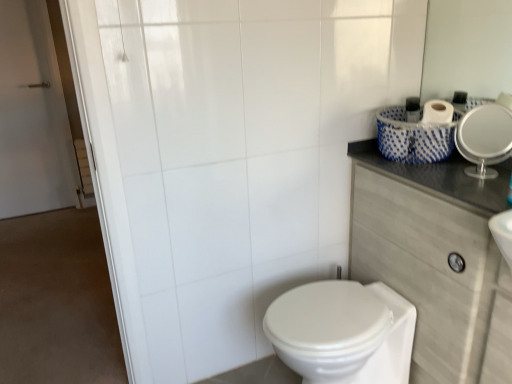
Question: In the image, is dark gray laminate counter top at upper right on the left side or the right side of white glossy mirror at upper right?

Choices:
 (A) left
 (B) right

Answer: (A)

Question: From a real-world perspective, relative to white glossy mirror at upper right, is dark gray laminate counter top at upper right vertically above or below?

Choices:
 (A) above
 (B) below

Answer: (B)

Question: Estimate the real-world distances between objects in this image. Which object is farther from the dark gray laminate counter top at upper right?

Choices:
 (A) white glossy bidet at lower center
 (B) white glossy mirror at upper right

Answer: (B)

Question: Which object is positioned farthest from the white glossy bidet at lower center?

Choices:
 (A) dark gray laminate counter top at upper right
 (B) white glossy mirror at upper right

Answer: (B)